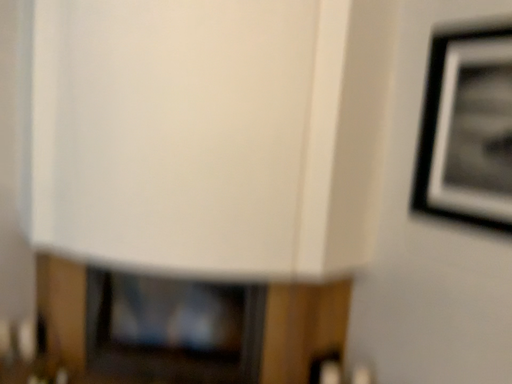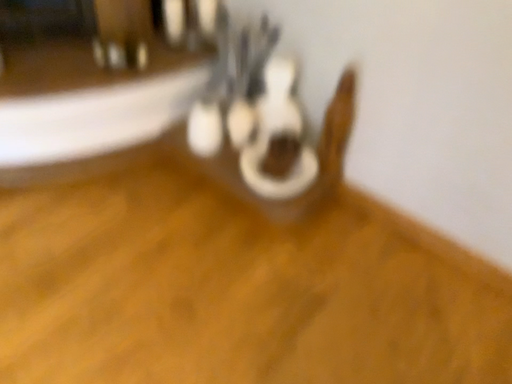
Question: How did the camera likely rotate when shooting the video?

Choices:
 (A) rotated upward
 (B) rotated downward

Answer: (B)